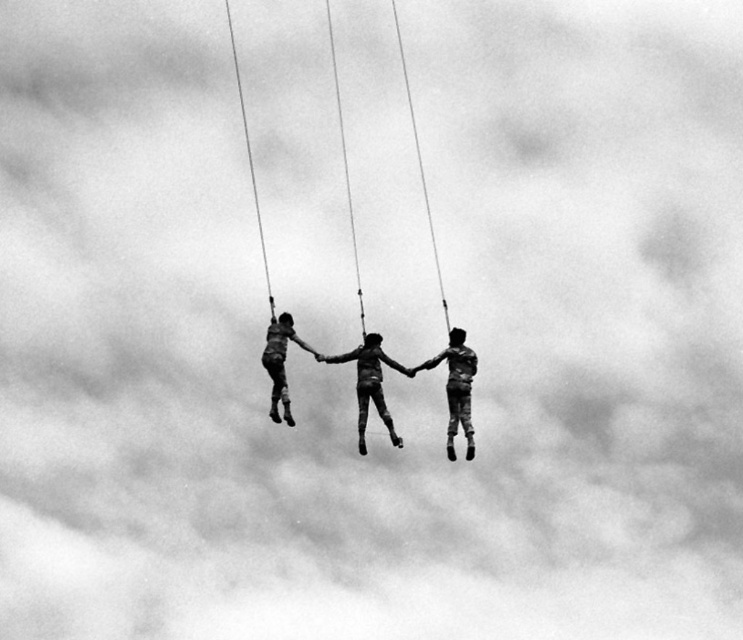
You are a photographer analyzing the composition of this image. You notice a point at coordinates point (x=337, y=362). What object is located at this point?

The point (x=337, y=362) contains the smooth fabric couple at center.